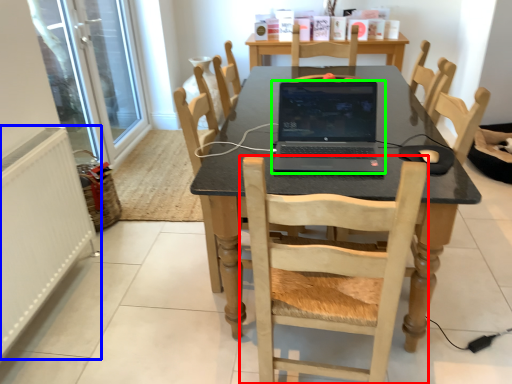
Question: Based on their relative distances, which object is farther from chair (highlighted by a red box)? Choose from radiator (highlighted by a blue box) and laptop (highlighted by a green box).

Choices:
 (A) radiator
 (B) laptop

Answer: (A)